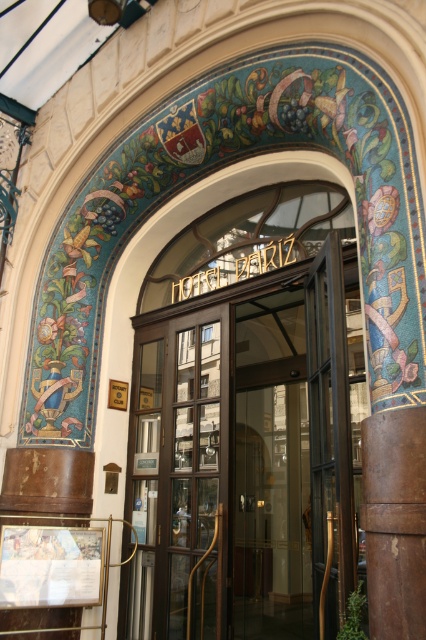
Question: Where is polished brass door at center located in relation to brown leather pillar at center in the image?

Choices:
 (A) above
 (B) below

Answer: (B)

Question: Is the position of polished brass door at center less distant than that of brown leather pillar at center?

Choices:
 (A) yes
 (B) no

Answer: (B)

Question: Does polished brass door at center lie behind brown leather pillar at center?

Choices:
 (A) no
 (B) yes

Answer: (B)